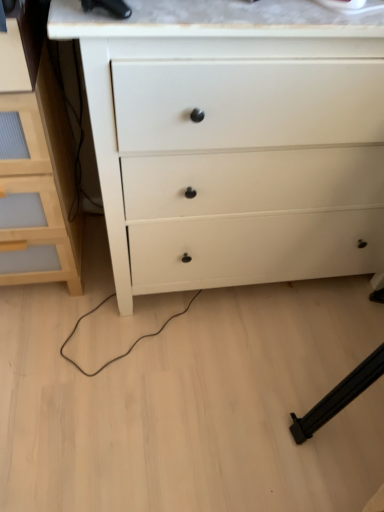
Question: Based on their positions, is light wood chest of drawers at left, which is the first chest of drawers from left to right, located to the left or right of white matte chest of drawers at center, the second chest of drawers viewed from the left?

Choices:
 (A) left
 (B) right

Answer: (A)

Question: From a real-world perspective, relative to white matte chest of drawers at center, the second chest of drawers viewed from the left, is light wood chest of drawers at left, which is the 2th chest of drawers from right to left, vertically above or below?

Choices:
 (A) above
 (B) below

Answer: (B)

Question: From the image's perspective, is light wood chest of drawers at left, which is the first chest of drawers from left to right, located above or below white matte chest of drawers at center, the second chest of drawers viewed from the left?

Choices:
 (A) below
 (B) above

Answer: (A)

Question: Looking at their shapes, would you say white matte chest of drawers at center, marked as the 1th chest of drawers in a right-to-left arrangement, is wider or thinner than light wood chest of drawers at left, which is the first chest of drawers from left to right?

Choices:
 (A) wide
 (B) thin

Answer: (A)

Question: Is white matte chest of drawers at center, marked as the 1th chest of drawers in a right-to-left arrangement, in front of or behind light wood chest of drawers at left, which is the 2th chest of drawers from right to left, in the image?

Choices:
 (A) behind
 (B) front

Answer: (B)

Question: From the image's perspective, is white matte chest of drawers at center, marked as the 1th chest of drawers in a right-to-left arrangement, above or below light wood chest of drawers at left, which is the 2th chest of drawers from right to left?

Choices:
 (A) below
 (B) above

Answer: (B)

Question: From their relative heights in the image, would you say white matte chest of drawers at center, marked as the 1th chest of drawers in a right-to-left arrangement, is taller or shorter than light wood chest of drawers at left, which is the first chest of drawers from left to right?

Choices:
 (A) tall
 (B) short

Answer: (A)